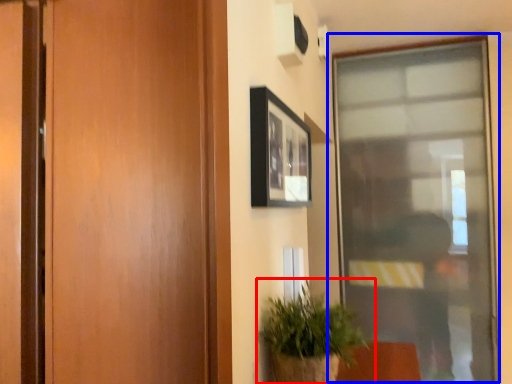
Question: Among these objects, which one is farthest to the camera, houseplant (highlighted by a red box) or window (highlighted by a blue box)?

Choices:
 (A) houseplant
 (B) window

Answer: (B)